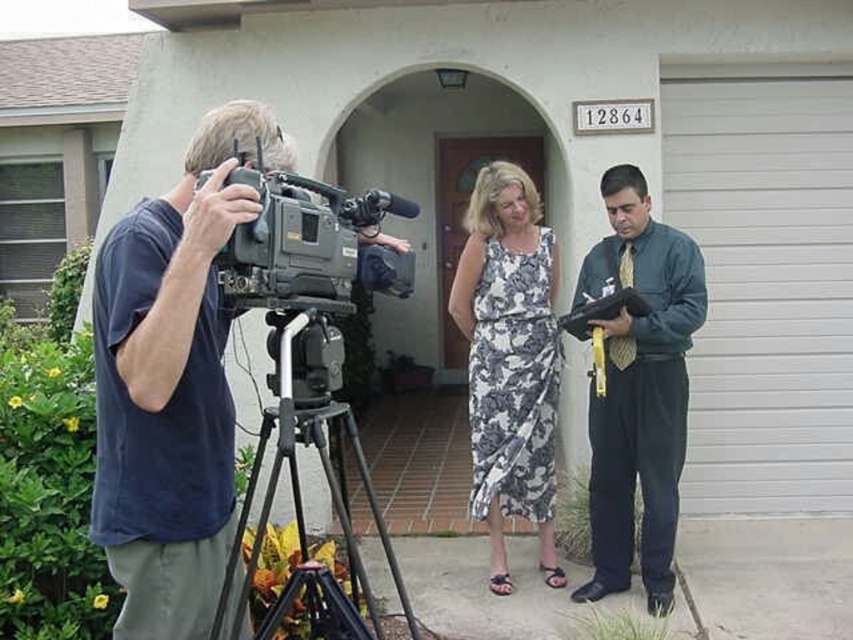
You are a photographer who needs to set up a tripod for a shot that requires the camera to be positioned to the right of the garage door. Based on the scene described, is the current placement of the black plastic video camera at left and the white smooth garage door at center suitable for this requirement?

The black plastic video camera at left is currently positioned to the left of the white smooth garage door at center, so it is not placed to the right of the garage door as required. The current setup does not meet the requirement.

You are a photographer positioned at the left side of the scene. You need to adjust your position to get both the green shirt at right and the white smooth garage door at center in your shot. Which direction should you move?

You should move to the left to include both the green shirt at right and the white smooth garage door at center in your shot since the green shirt at right is to the right of the white smooth garage door at center.